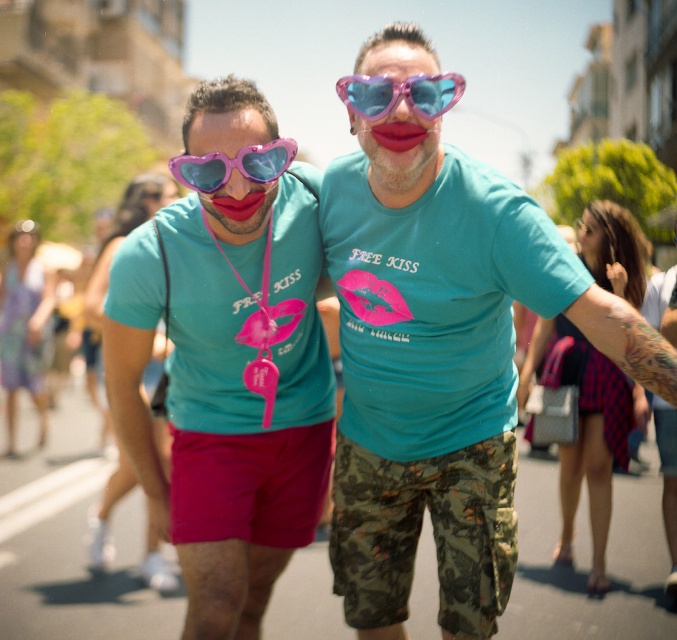
Find the location of `pink plastic heart-shaped goggles at upper center`. pink plastic heart-shaped goggles at upper center is located at coordinates (399, 93).

Can you confirm if pink plastic heart-shaped goggles at upper center is taller than pink plastic heart-shaped goggles at center?

Correct, pink plastic heart-shaped goggles at upper center is much taller as pink plastic heart-shaped goggles at center.

Is point (345, 99) positioned before point (215, 150)?

No, (345, 99) is further to viewer.

Identify the location of pink plastic heart-shaped goggles at upper center. (399, 93).

Can you confirm if matte pink sunglasses at center is thinner than pink plastic heart-shaped goggles at center?

No.

Is point (139, 272) more distant than point (265, 154)?

Yes, it is.

I want to click on matte pink sunglasses at center, so click(x=230, y=358).

Which is below, matte pink sunglasses at center or pink plastic heart-shaped goggles at upper center?

matte pink sunglasses at center

Find the location of `matte pink sunglasses at center`. matte pink sunglasses at center is located at coordinates (230, 358).

The height and width of the screenshot is (640, 677). Identify the location of matte pink sunglasses at center. (230, 358).